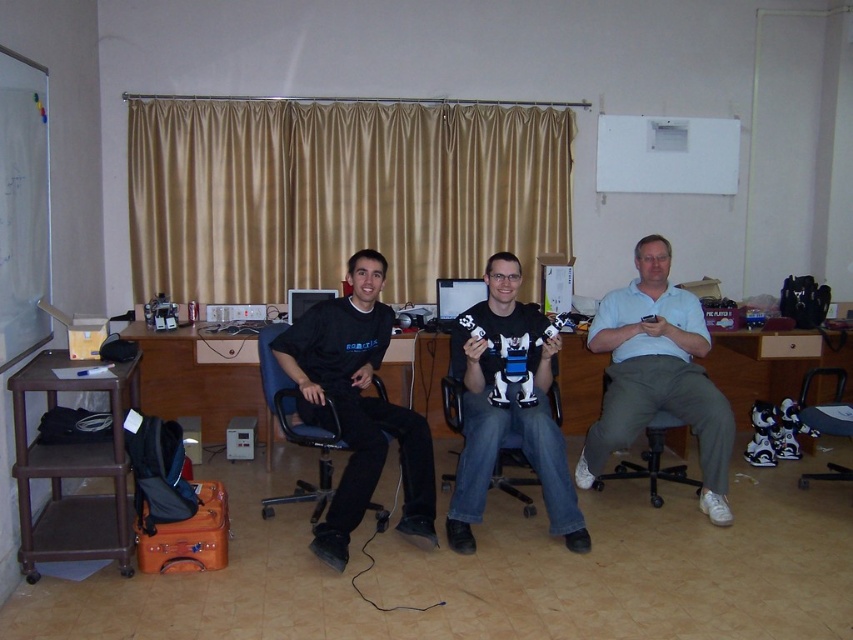
Question: Does brown plastic table at lower left appear over black plastic swivel chair at lower right?

Choices:
 (A) yes
 (B) no

Answer: (B)

Question: Considering the relative positions of matte black shirt at center and black plastic chair at center in the image provided, where is matte black shirt at center located with respect to black plastic chair at center?

Choices:
 (A) left
 (B) right

Answer: (A)

Question: Can you confirm if brown wood computer desk at center is positioned to the right of black plastic swivel chair at lower right?

Choices:
 (A) no
 (B) yes

Answer: (A)

Question: Which point is farther to the camera?

Choices:
 (A) white cotton shirt at center
 (B) matte black shirt at center

Answer: (A)

Question: Which of the following is the farthest from the observer?

Choices:
 (A) black plastic chair at center
 (B) blue plastic chair at left
 (C) black matte robot at center

Answer: (A)

Question: Which object appears farthest from the camera in this image?

Choices:
 (A) brown plastic table at lower left
 (B) black matte robot at center

Answer: (B)